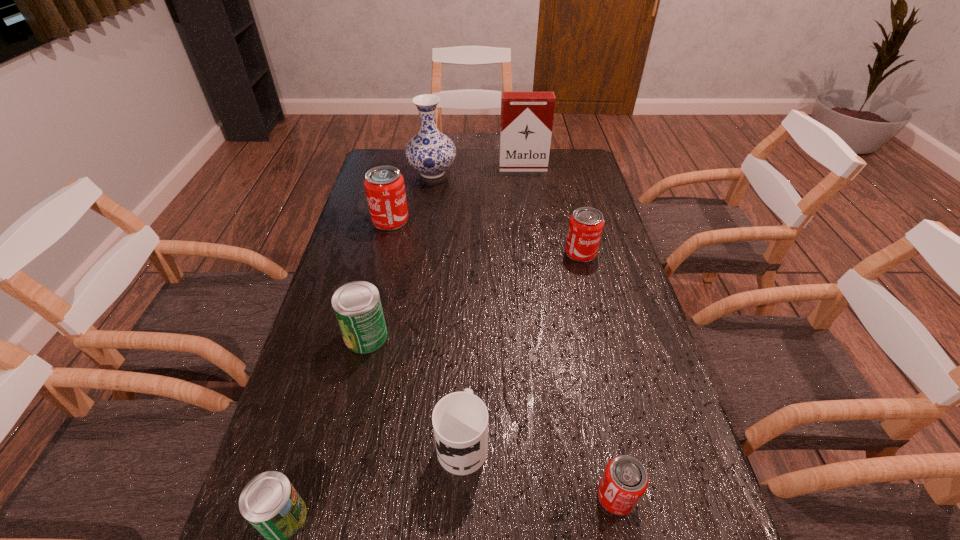
Find the location of a particular element. The image size is (960, 540). vase present at the far edge is located at coordinates (430, 152).

Identify the location of cigarette_case present at the far edge. The height and width of the screenshot is (540, 960). (526, 124).

Identify the location of vase present at the left edge. (430, 152).

Identify the location of object present at the far left corner. (430, 152).

Where is `blank area at the left edge`? Image resolution: width=960 pixels, height=540 pixels. blank area at the left edge is located at coordinates pyautogui.click(x=365, y=275).

Find the location of a particular element. The width and height of the screenshot is (960, 540). free region at the right edge of the desktop is located at coordinates (605, 294).

Identify the location of vacant space at the far right corner. (573, 173).

The width and height of the screenshot is (960, 540). What are the coordinates of `free space between the second farthest can and the smallest red can` in the screenshot? It's located at (598, 374).

At what (x,y) coordinates should I click in order to perform the action: click on empty location between the sixth farthest object and the second farthest red can. Please return your answer as a coordinate pair (x, y). Looking at the image, I should click on (521, 347).

The height and width of the screenshot is (540, 960). In order to click on vacant area between the smallest red can and the white mug in this screenshot , I will do `click(540, 469)`.